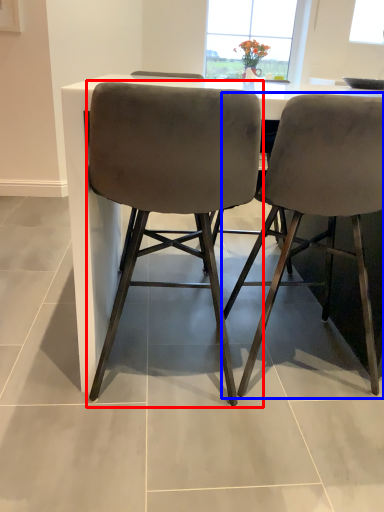
Question: Which of the following is the farthest to the observer, chair (highlighted by a red box) or chair (highlighted by a blue box)?

Choices:
 (A) chair
 (B) chair

Answer: (B)